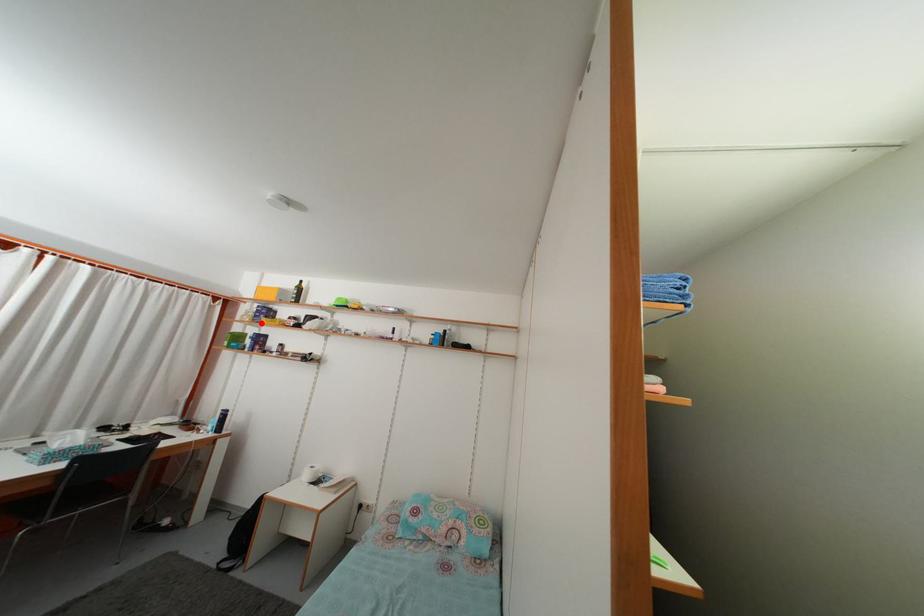
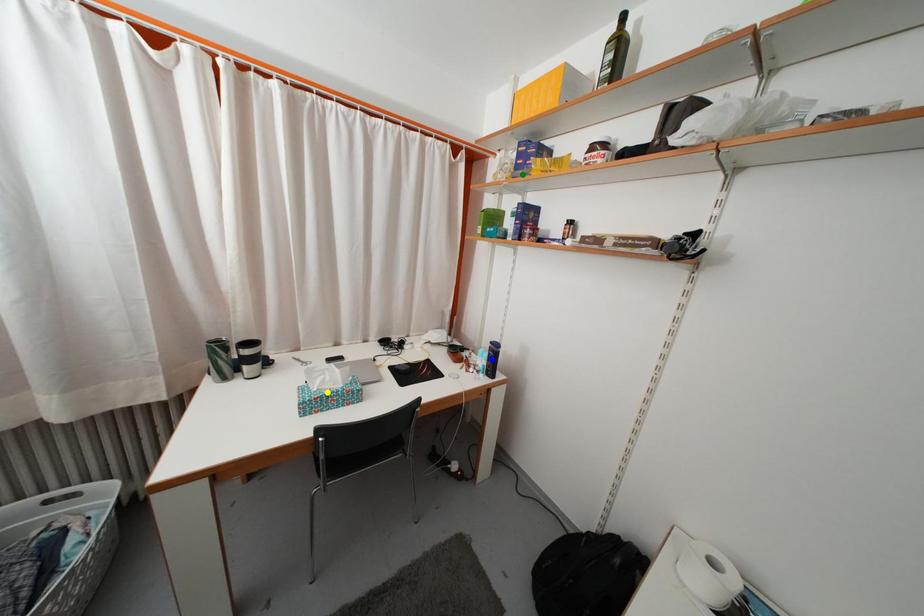
Question: I am providing you with two images of the same scene from different viewpoints. A red point is marked on the first image. You are given multiple points on the second image. Which spot in image 2 lines up with the point in image 1?

Choices:
 (A) yellow point
 (B) blue point
 (C) green point

Answer: (C)